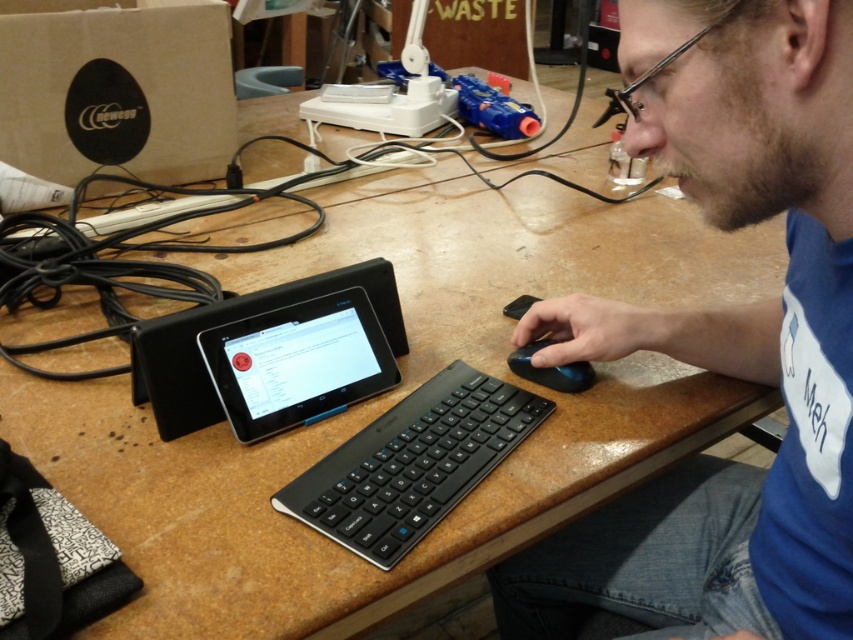
Question: Which point is farther from the camera taking this photo?

Choices:
 (A) (657, 486)
 (B) (360, 474)
 (C) (531, 376)

Answer: (A)

Question: Is blue matte mouse at center in front of black matte keyboard at center?

Choices:
 (A) yes
 (B) no

Answer: (A)

Question: Which point appears farthest from the camera in this image?

Choices:
 (A) (579, 380)
 (B) (833, 436)

Answer: (A)

Question: Which of the following is the farthest from the observer?

Choices:
 (A) (300, 513)
 (B) (521, 356)

Answer: (B)

Question: Is black glossy tablet at center positioned before black matte mouse at lower right?

Choices:
 (A) yes
 (B) no

Answer: (A)

Question: Can you confirm if black glossy tablet at center is wider than black matte mouse at lower right?

Choices:
 (A) yes
 (B) no

Answer: (A)